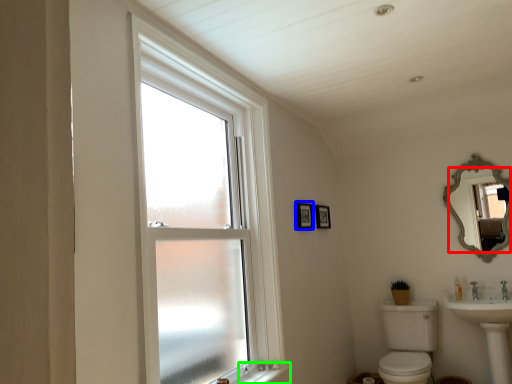
Question: Estimate the real-world distances between objects in this image. Which object is closer to mirror (highlighted by a red box), picture frame (highlighted by a blue box) or window sill (highlighted by a green box)?

Choices:
 (A) picture frame
 (B) window sill

Answer: (A)